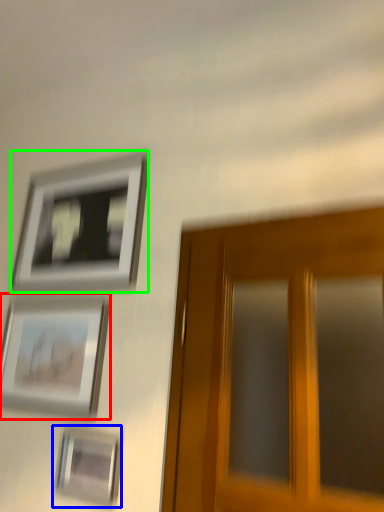
Question: Estimate the real-world distances between objects in this image. Which object is closer to picture frame (highlighted by a red box), picture frame (highlighted by a blue box) or picture frame (highlighted by a green box)?

Choices:
 (A) picture frame
 (B) picture frame

Answer: (A)